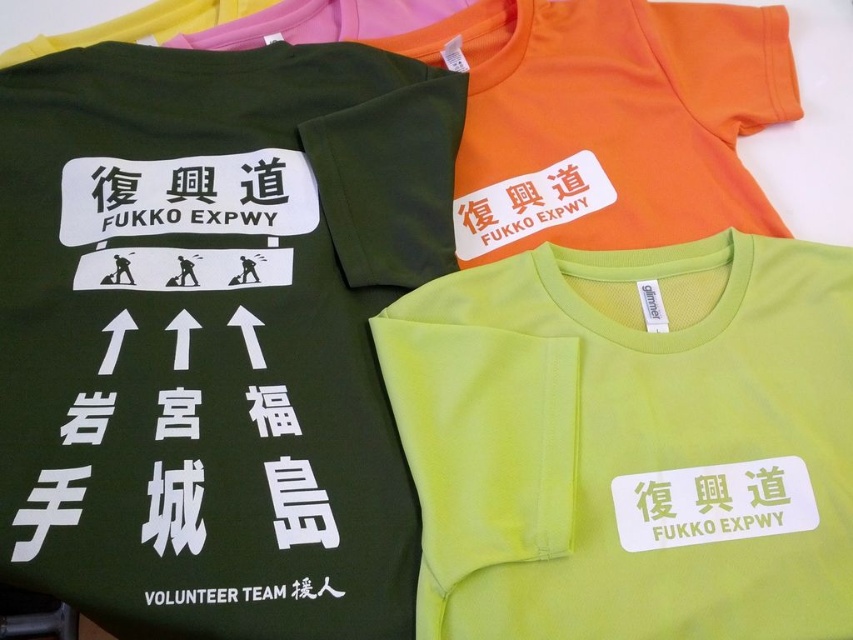
What color is the tshirt located at point (215, 332)?

The tshirt at point (215, 332) is matte green.